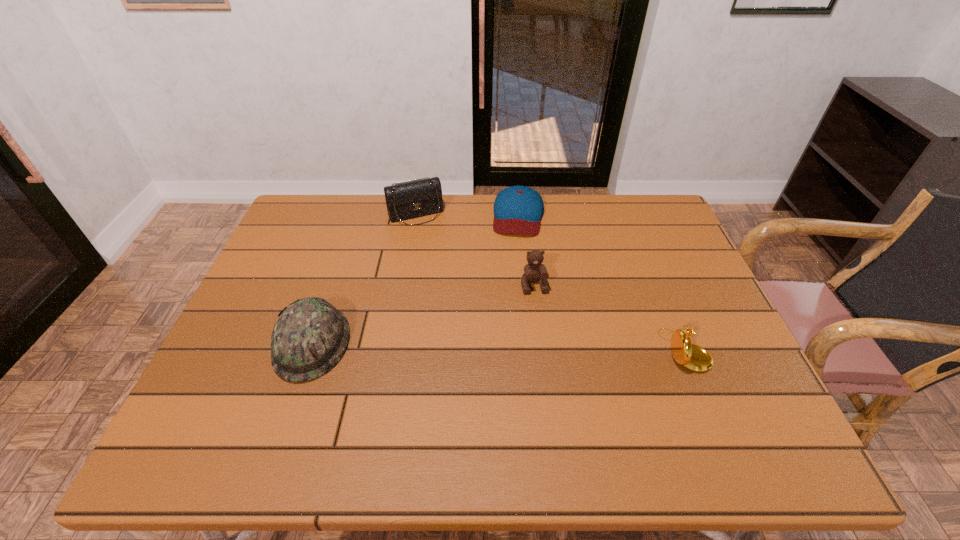
Find the location of a particular element. vacant space located 0.080m with the bill of the baseball cap facing forward is located at coordinates (516, 255).

Find the location of a particular element. The width and height of the screenshot is (960, 540). free point located 0.340m with the bill of the baseball cap facing forward is located at coordinates (508, 321).

I want to click on free point located on the front flap of the fourth object from right to left, so click(x=444, y=269).

Locate an element on the screen. This screenshot has width=960, height=540. vacant position located 0.330m on the front flap of the fourth object from right to left is located at coordinates (456, 295).

The width and height of the screenshot is (960, 540). I want to click on vacant space situated 0.300m on the front flap of the fourth object from right to left, so point(453,288).

Identify the location of baseball cap situated at the far edge. (517, 209).

Where is `clutch bag present at the far edge`? The height and width of the screenshot is (540, 960). clutch bag present at the far edge is located at coordinates (412, 199).

The width and height of the screenshot is (960, 540). I want to click on object located in the near edge section of the desktop, so click(310, 336).

Identify the location of object that is at the left edge. The width and height of the screenshot is (960, 540). (310, 336).

I want to click on object that is positioned at the right edge, so click(x=693, y=357).